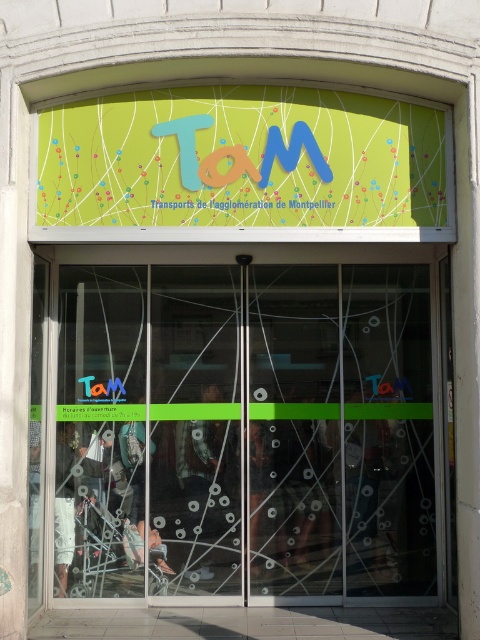
Between point (180, 346) and point (119, 112), which one is positioned in front?

Point (119, 112) is more forward.

Can you confirm if transparent glass doors at center is positioned to the left of matte green signboard at upper center?

Incorrect, transparent glass doors at center is not on the left side of matte green signboard at upper center.

Between point (325, 400) and point (342, 125), which one is positioned in front?

Positioned in front is point (342, 125).

I want to click on transparent glass doors at center, so click(x=250, y=428).